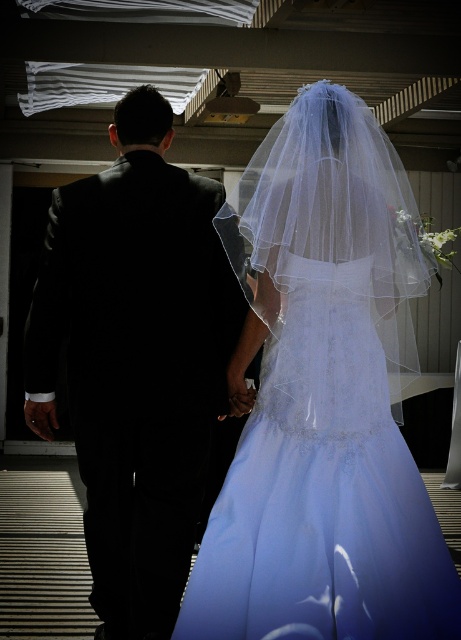
Question: Can you confirm if translucent white veil at upper center is bigger than black satin suit at left?

Choices:
 (A) yes
 (B) no

Answer: (A)

Question: Can you confirm if translucent white veil at upper center is bigger than black satin suit at left?

Choices:
 (A) no
 (B) yes

Answer: (B)

Question: Which point is closer to the camera?

Choices:
 (A) (176, 260)
 (B) (248, 282)

Answer: (A)

Question: Can you confirm if translucent white veil at upper center is positioned above black satin suit at left?

Choices:
 (A) no
 (B) yes

Answer: (B)

Question: Which point is closer to the camera taking this photo?

Choices:
 (A) (400, 480)
 (B) (49, 410)

Answer: (A)